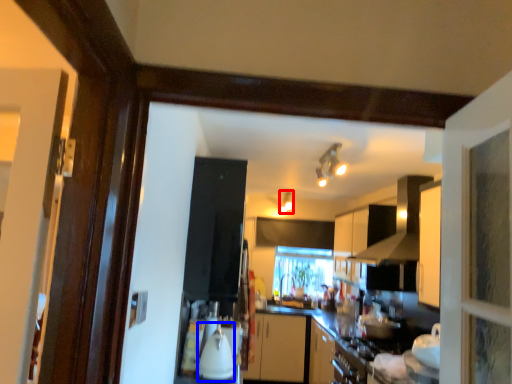
Question: Which point is further to the camera, light fixture (highlighted by a red box) or appliance (highlighted by a blue box)?

Choices:
 (A) light fixture
 (B) appliance

Answer: (A)